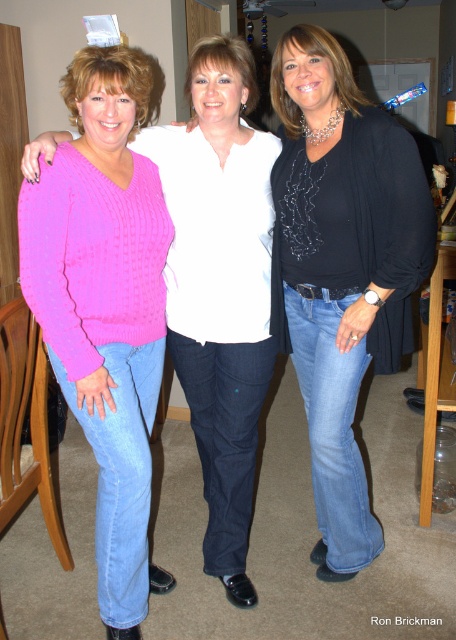
Question: Which point is closer to the camera taking this photo?

Choices:
 (A) pyautogui.click(x=130, y=358)
 (B) pyautogui.click(x=373, y=266)

Answer: (B)

Question: Does black matte shirt at center appear over pink knitted sweater at left?

Choices:
 (A) yes
 (B) no

Answer: (A)

Question: Is black matte shirt at center smaller than pink knitted sweater at left?

Choices:
 (A) yes
 (B) no

Answer: (B)

Question: Does black matte shirt at center have a greater width compared to pink knitted sweater at left?

Choices:
 (A) no
 (B) yes

Answer: (B)

Question: Which point is closer to the camera taking this photo?

Choices:
 (A) (331, 196)
 (B) (86, 410)

Answer: (B)

Question: Which point is farther to the camera?

Choices:
 (A) pink knitted sweater at left
 (B) black matte shirt at center

Answer: (B)